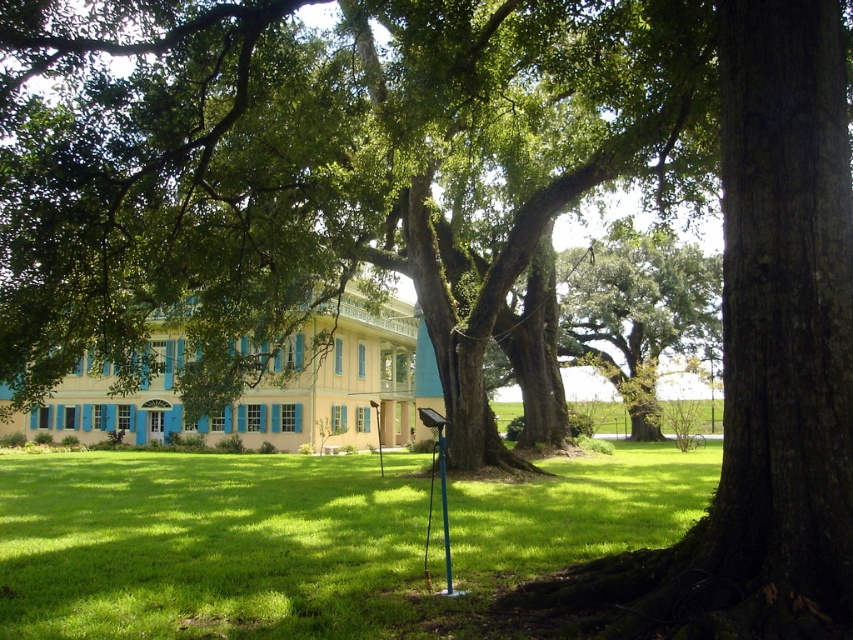
Question: Is green leafy tree at center closer to camera compared to green plastic pole at center?

Choices:
 (A) no
 (B) yes

Answer: (A)

Question: Based on their relative distances, which object is nearer to the green leafy tree at center?

Choices:
 (A) green plastic pole at center
 (B) green grass at center

Answer: (B)

Question: Which point is farther to the camera?

Choices:
 (A) green plastic pole at center
 (B) green leafy tree at center

Answer: (B)

Question: Is green grass at center to the left of green plastic pole at center from the viewer's perspective?

Choices:
 (A) yes
 (B) no

Answer: (A)

Question: Where is green grass at center located in relation to green plastic pole at center in the image?

Choices:
 (A) right
 (B) left

Answer: (B)

Question: Which point appears farthest from the camera in this image?

Choices:
 (A) (0, 508)
 (B) (437, 460)

Answer: (B)